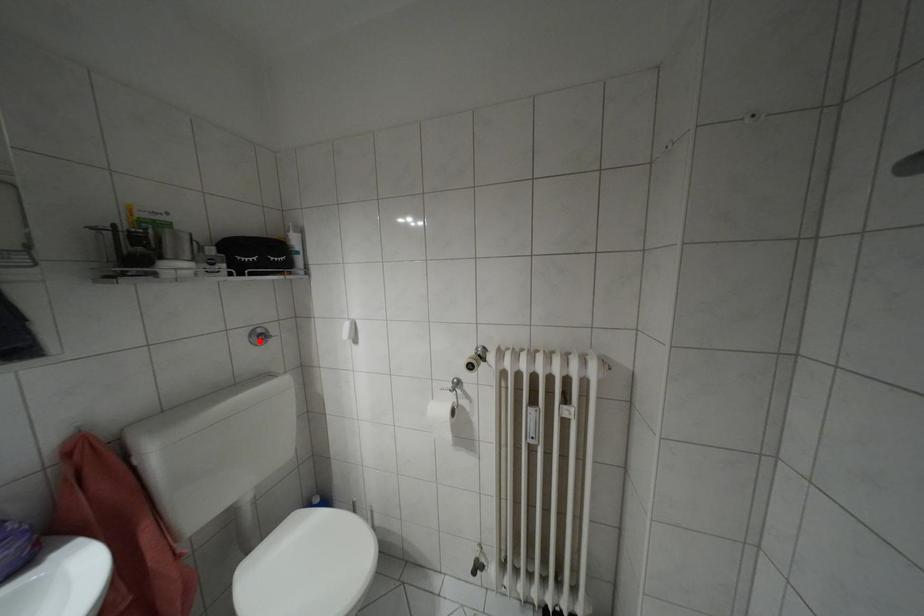
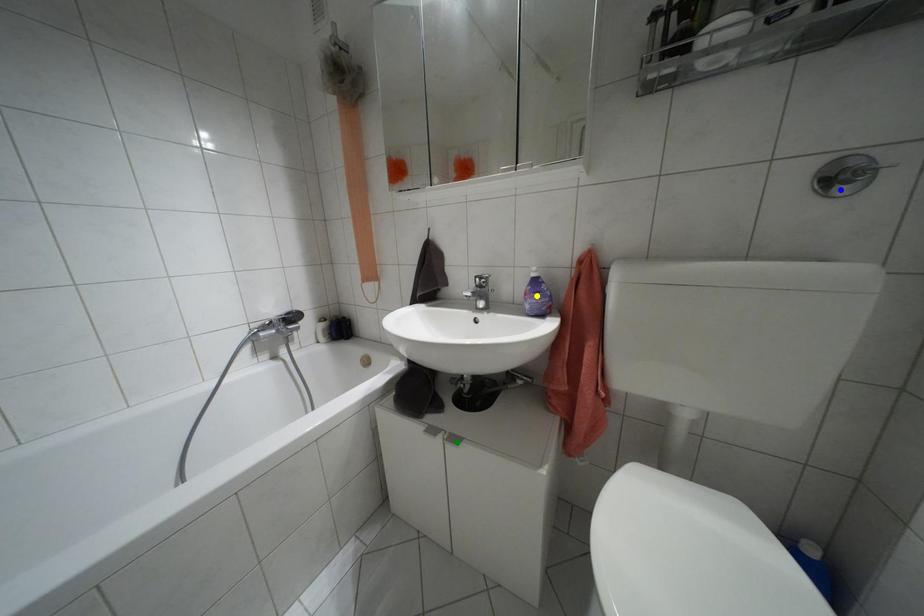
Question: I am providing you with two images of the same scene from different viewpoints. A red point is marked on the first image. You are given multiple points on the second image. Which point in image 2 represents the same 3d spot as the red point in image 1?

Choices:
 (A) green point
 (B) yellow point
 (C) blue point

Answer: (C)